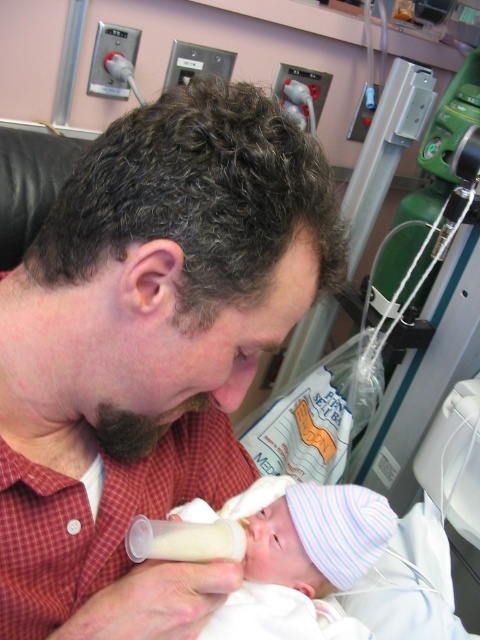
Is red checkered shirt at center taller than white striped knit hat at center?

Indeed, red checkered shirt at center has a greater height compared to white striped knit hat at center.

Is red checkered shirt at center above white striped knit hat at center?

Yes.

Is point (280, 230) positioned behind point (265, 624)?

That is False.

Where is `red checkered shirt at center`? This screenshot has height=640, width=480. red checkered shirt at center is located at coordinates (148, 349).